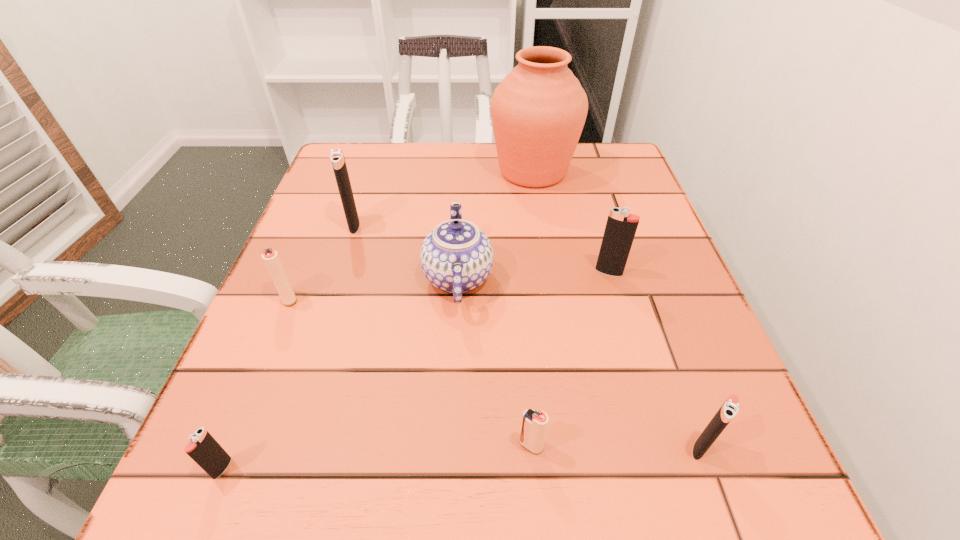
This screenshot has width=960, height=540. Find the location of `urn`. urn is located at coordinates (538, 111).

Identify the location of the farthest object. (538, 111).

Locate an element on the screen. the biggest black igniter is located at coordinates (337, 158).

Where is `the farthest black igniter`? This screenshot has height=540, width=960. the farthest black igniter is located at coordinates (337, 158).

Find the location of a particular element. The width and height of the screenshot is (960, 540). the second black igniter from right to left is located at coordinates (621, 226).

Locate an element on the screen. The image size is (960, 540). the fifth shortest igniter is located at coordinates (621, 226).

Find the location of a particular element. the fifth object from right to left is located at coordinates (456, 257).

Identify the location of chinaware. (456, 257).

Image resolution: width=960 pixels, height=540 pixels. What are the coordinates of `the second smallest black igniter` in the screenshot? It's located at (729, 409).

Identify the location of the rightmost object. This screenshot has height=540, width=960. (729, 409).